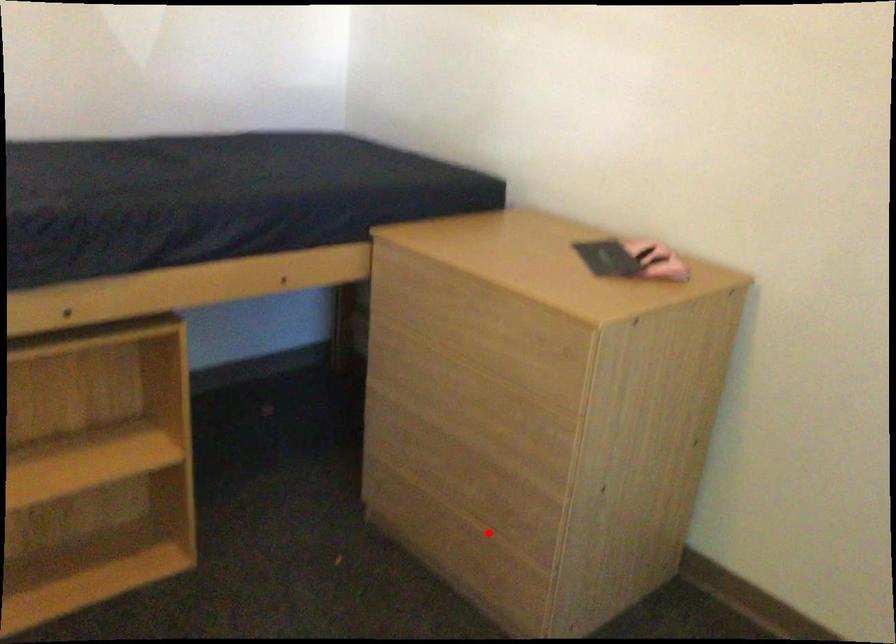
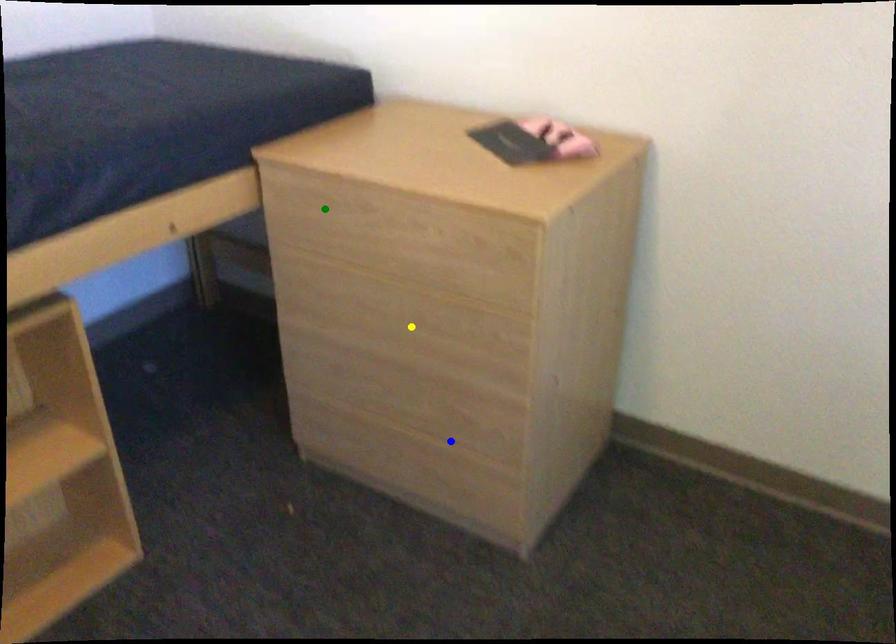
Question: I am providing you with two images of the same scene from different viewpoints. A red point is marked on the first image. You are given multiple points on the second image. Can you choose the point in image 2 that corresponds to the point in image 1?

Choices:
 (A) blue point
 (B) yellow point
 (C) green point

Answer: (A)